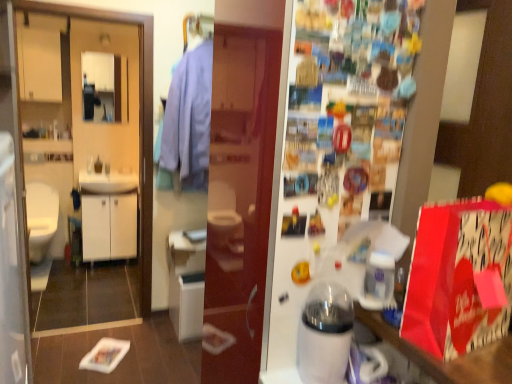
Question: In terms of width, does matte white cabinet at upper left, which is the first cabinetry in left-to-right order, look wider or thinner when compared to light blue fabric shirt at center?

Choices:
 (A) wide
 (B) thin

Answer: (B)

Question: In terms of height, does matte white cabinet at upper left, which is the first cabinetry in left-to-right order, look taller or shorter compared to light blue fabric shirt at center?

Choices:
 (A) tall
 (B) short

Answer: (B)

Question: Which object is positioned farthest from the light blue fabric shirt at center?

Choices:
 (A) matte white medicine cabinet at upper left
 (B) matte white cabinet at upper left, which is counted as the first cabinetry, starting from the top
 (C) white glossy toilet at left
 (D) white plastic water dispenser at center, the second appliance in the left-to-right sequence
 (E) white glossy fridge at upper center

Answer: (C)

Question: Estimate the real-world distances between objects in this image. Which object is farther from the light blue fabric shirt at center?

Choices:
 (A) white glossy sink at left
 (B) matte white cabinet at upper left, which is counted as the first cabinetry, starting from the top
 (C) white glossy fridge at upper center
 (D) white glossy humidifier at center, which ranks as the second appliance in right-to-left order
 (E) transparent plastic screen door at left

Answer: (D)